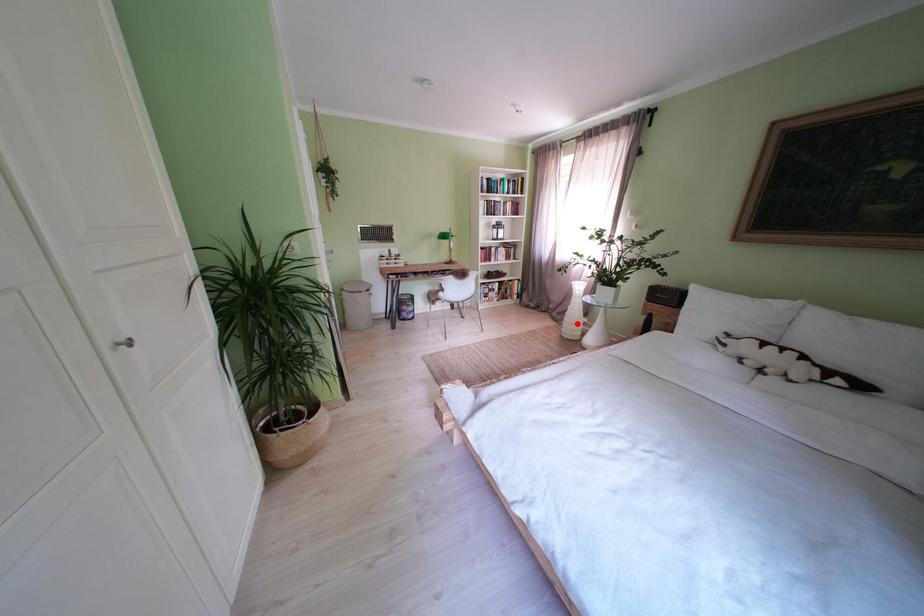
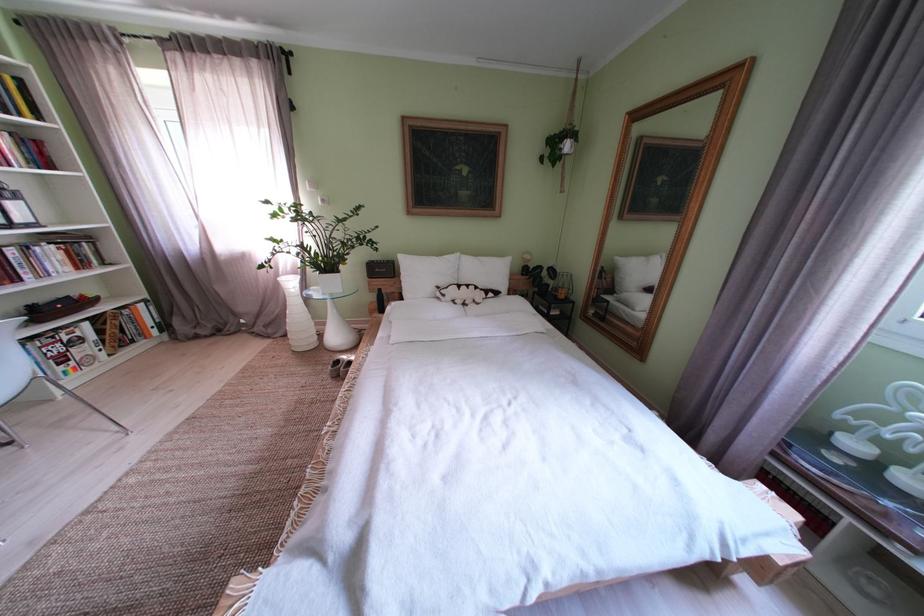
Find the pixel in the second image that matches the highlighted location in the first image.

(301, 334)